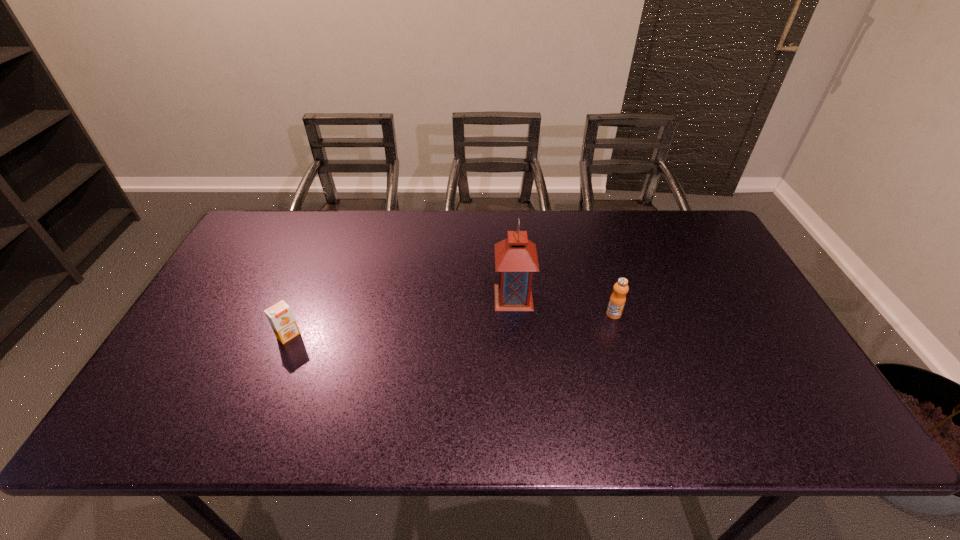
In the image, there is a desktop. Where is `vacant space at the near edge`? vacant space at the near edge is located at coordinates (301, 409).

In order to click on free region at the left edge in this screenshot , I will do `click(185, 368)`.

Find the location of a particular element. vacant space at the right edge of the desktop is located at coordinates (775, 337).

You are a GUI agent. You are given a task and a screenshot of the screen. Output one action in this format:
    pyautogui.click(x=<x>, y=<y>)
    Task: Click on the vacant region at the far left corner
    The image size is (960, 540).
    Given the screenshot: What is the action you would take?
    pyautogui.click(x=248, y=240)

Identify the location of free spot between the farther orange juice and the lantern. (564, 306).

Locate an element on the screen. This screenshot has height=540, width=960. free spot between the tallest object and the leftmost object is located at coordinates (401, 316).

The image size is (960, 540). What are the coordinates of `unoccupied position between the leftmost object and the lantern` in the screenshot? It's located at (401, 316).

This screenshot has height=540, width=960. Identify the location of free point between the taller orange juice and the shorter orange juice. click(x=451, y=325).

Identify the location of unoccupied position between the shorter orange juice and the right orange juice. (451, 325).

The width and height of the screenshot is (960, 540). In order to click on vacant area that lies between the farther orange juice and the shortest object in this screenshot , I will do pyautogui.click(x=451, y=325).